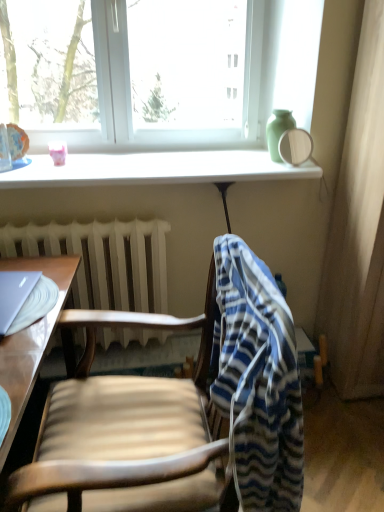
Identify the location of white glossy window sill at upper center. (156, 169).

Can you confirm if white matte radiator at lower center is smaller than wooden chair at center?

Indeed, white matte radiator at lower center has a smaller size compared to wooden chair at center.

Which is nearer, (162, 295) or (191, 390)?

Point (162, 295) appears to be farther away from the viewer than point (191, 390).

Does white matte radiator at lower center come behind wooden chair at center?

That is True.

Are white matte radiator at lower center and wooden chair at center located far from each other?

No.

Does transparent glass mirror at upper right lie in front of white glossy window sill at upper center?

That is False.

Considering the sizes of transparent glass mirror at upper right and white glossy window sill at upper center in the image, is transparent glass mirror at upper right bigger or smaller than white glossy window sill at upper center?

In the image, transparent glass mirror at upper right appears to be smaller than white glossy window sill at upper center.

Does transparent glass mirror at upper right appear on the right side of white glossy window sill at upper center?

Yes.

What's the angular difference between transparent glass mirror at upper right and white glossy window sill at upper center's facing directions?

The angular difference between transparent glass mirror at upper right and white glossy window sill at upper center is 2.45 degrees.

Considering the relative positions of blue striped fabric at center and green matte vase at upper right in the image provided, is blue striped fabric at center to the left or to the right of green matte vase at upper right?

Based on their positions, blue striped fabric at center is located to the left of green matte vase at upper right.

Is there a large distance between blue striped fabric at center and green matte vase at upper right?

Yes, blue striped fabric at center is far from green matte vase at upper right.

Can you tell me how much blue striped fabric at center and green matte vase at upper right differ in facing direction?

The angle between the facing direction of blue striped fabric at center and the facing direction of green matte vase at upper right is 90.9 degrees.

Which of these two, green matte vase at upper right or satin silver laptop at left, stands taller?

green matte vase at upper right is taller.

What's the angular difference between green matte vase at upper right and satin silver laptop at left's facing directions?

They differ by 9.05 degrees in their facing directions.

Find the location of a particular element. Image resolution: width=384 pixels, height=512 pixels. vase lying behind the satin silver laptop at left is located at coordinates (278, 130).

Is green matte vase at upper right oriented away from satin silver laptop at left?

That's not correct — green matte vase at upper right is not looking away from satin silver laptop at left.

Consider the image. Which is in front, white plastic window at upper center or white matte radiator at lower center?

white matte radiator at lower center is more forward.

In terms of size, does white plastic window at upper center appear bigger or smaller than white matte radiator at lower center?

white plastic window at upper center is bigger than white matte radiator at lower center.

Is white plastic window at upper center taller than white matte radiator at lower center?

In fact, white plastic window at upper center may be shorter than white matte radiator at lower center.

Can you tell me how much white plastic window at upper center and white matte radiator at lower center differ in facing direction?

There is a 0.501-degree angle between the facing directions of white plastic window at upper center and white matte radiator at lower center.

Is blue striped fabric at center aimed at white glossy window sill at upper center?

No, blue striped fabric at center is not turned towards white glossy window sill at upper center.

Who is bigger, blue striped fabric at center or white glossy window sill at upper center?

With larger size is blue striped fabric at center.

From the image's perspective, does blue striped fabric at center appear higher than white glossy window sill at upper center?

Incorrect, from the image's perspective, blue striped fabric at center is lower than white glossy window sill at upper center.

Which is more to the right, white matte radiator at lower center or satin silver laptop at left?

white matte radiator at lower center is more to the right.

Can you confirm if white matte radiator at lower center is bigger than satin silver laptop at left?

Indeed, white matte radiator at lower center has a larger size compared to satin silver laptop at left.

Locate an element on the screen. Image resolution: width=384 pixels, height=512 pixels. laptop above the white matte radiator at lower center (from the image's perspective) is located at coordinates (14, 296).

Is white matte radiator at lower center looking in the opposite direction of satin silver laptop at left?

No.

At what (x,y) coordinates should I click in order to perform the action: click on chair that is on the right side of white matte radiator at lower center. Please return your answer as a coordinate pair (x, y). Looking at the image, I should click on (180, 411).

Locate an element on the screen. The width and height of the screenshot is (384, 512). mirror behind the white glossy window sill at upper center is located at coordinates (295, 146).

Considering their positions, is white plastic window at upper center positioned closer to green matte vase at upper right than transparent glass mirror at upper right?

white plastic window at upper center is closer to green matte vase at upper right.

Looking at the image, which one is located closer to light brown wooden desk at left, transparent glass mirror at upper right or white glossy window sill at upper center?

Among the two, white glossy window sill at upper center is located nearer to light brown wooden desk at left.

Which object lies further to the anchor point blue striped fabric at center, satin silver laptop at left or transparent glass mirror at upper right?

Among the two, transparent glass mirror at upper right is located further to blue striped fabric at center.

From the image, which object appears to be farther from green matte vase at upper right, white matte radiator at lower center or blue striped fabric at center?

blue striped fabric at center.

Estimate the real-world distances between objects in this image. Which object is closer to green matte vase at upper right, wooden chair at center or light brown wooden desk at left?

light brown wooden desk at left.

Based on their spatial positions, is wooden chair at center or light brown wooden desk at left closer to white matte radiator at lower center?

Among the two, light brown wooden desk at left is located nearer to white matte radiator at lower center.

When comparing their distances from blue striped fabric at center, does white glossy window sill at upper center or light brown wooden desk at left seem closer?

The object closer to blue striped fabric at center is light brown wooden desk at left.

From the image, which object appears to be nearer to transparent glass mirror at upper right, wooden chair at center or satin silver laptop at left?

satin silver laptop at left is closer to transparent glass mirror at upper right.

This screenshot has height=512, width=384. I want to click on radiator located between wooden chair at center and green matte vase at upper right in the depth direction, so click(103, 260).

At what (x,y) coordinates should I click in order to perform the action: click on radiator between wooden chair at center and transparent glass mirror at upper right from front to back. Please return your answer as a coordinate pair (x, y). Looking at the image, I should click on (103, 260).

This screenshot has height=512, width=384. I want to click on chair between satin silver laptop at left and blue striped fabric at center in the horizontal direction, so click(x=180, y=411).

In order to click on laptop between wooden chair at center and white matte radiator at lower center along the z-axis in this screenshot , I will do `click(14, 296)`.